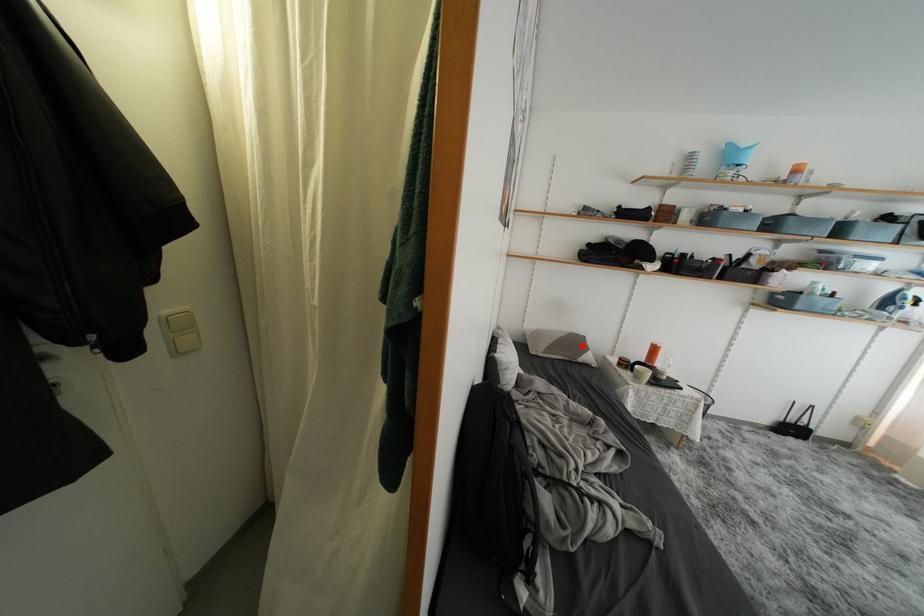
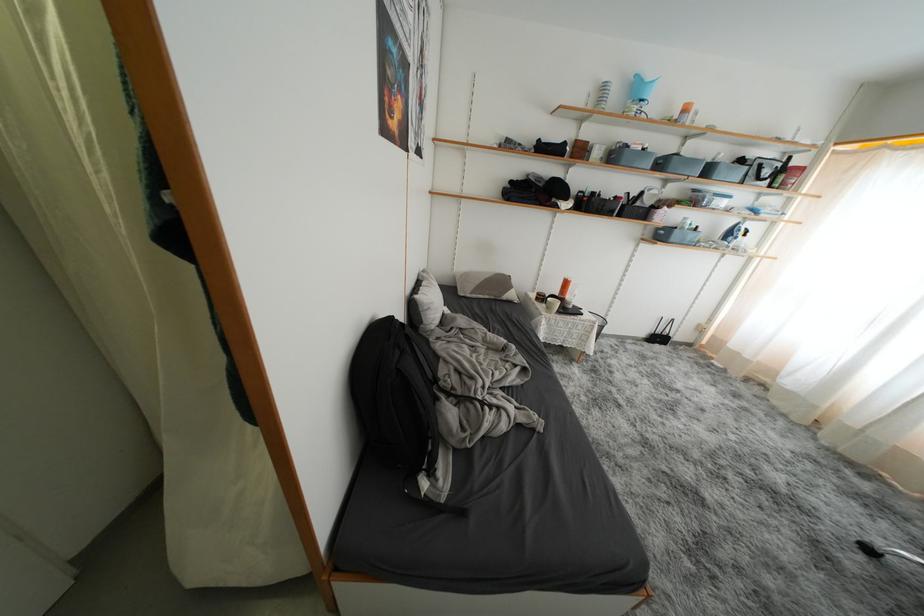
Where in the second image is the point corresponding to the highlighted location from the first image?

(508, 286)